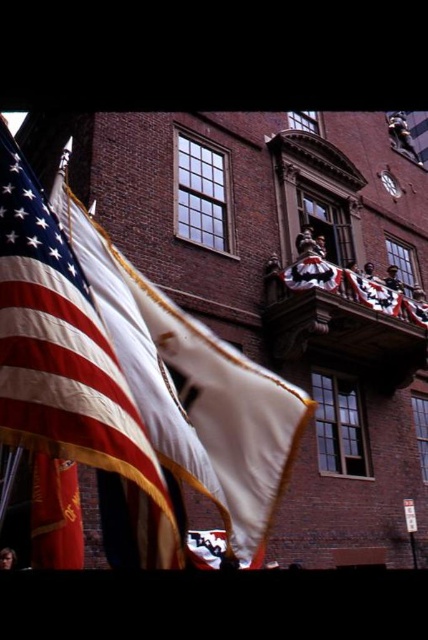
Question: In this image, where is matte white flag at left located relative to red satin flag at lower left?

Choices:
 (A) below
 (B) above

Answer: (B)

Question: Which object appears farthest from the camera in this image?

Choices:
 (A) matte white flag at left
 (B) decorative wood balcony at upper center

Answer: (B)

Question: Which of the following is the farthest from the observer?

Choices:
 (A) (151, 440)
 (B) (321, 300)

Answer: (B)

Question: Is matte white flag at left bigger than decorative wood balcony at upper center?

Choices:
 (A) no
 (B) yes

Answer: (A)

Question: Which point is closer to the camera?

Choices:
 (A) (51, 499)
 (B) (196, 376)

Answer: (A)

Question: Is decorative wood balcony at upper center wider than red satin flag at lower left?

Choices:
 (A) no
 (B) yes

Answer: (B)